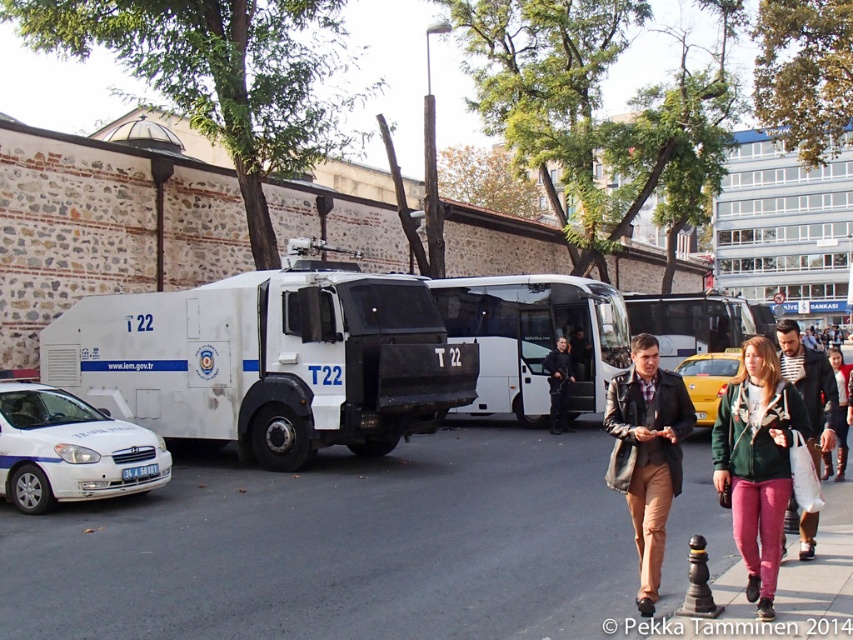
Question: Considering the real-world distances, which object is closest to the green fabric jacket at lower right?

Choices:
 (A) white matte bus at center
 (B) striped fabric jacket at center

Answer: (B)

Question: Does green fleece jacket at center have a greater width compared to green fabric jacket at lower right?

Choices:
 (A) no
 (B) yes

Answer: (A)

Question: Does white glossy sedan at lower left have a larger size compared to black leather jacket at center?

Choices:
 (A) no
 (B) yes

Answer: (B)

Question: Which object appears closest to the camera in this image?

Choices:
 (A) yellow matte taxi at center
 (B) white plastic tour bus at center
 (C) green fleece jacket at center

Answer: (C)

Question: Which point appears farthest from the camera in this image?

Choices:
 (A) (836, 381)
 (B) (804, 378)

Answer: (A)

Question: Considering the relative positions of white matte armored vehicle at left and yellow matte taxi at center in the image provided, where is white matte armored vehicle at left located with respect to yellow matte taxi at center?

Choices:
 (A) right
 (B) left

Answer: (B)